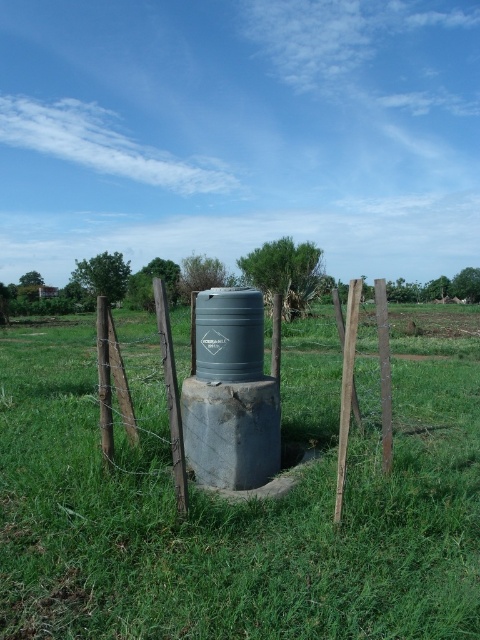
Can you confirm if green grassy at center is positioned below wooden post at center?

Indeed, green grassy at center is positioned under wooden post at center.

Describe the element at coordinates (237, 506) in the screenshot. I see `green grassy at center` at that location.

Find the location of a particular element. The width and height of the screenshot is (480, 640). green grassy at center is located at coordinates (237, 506).